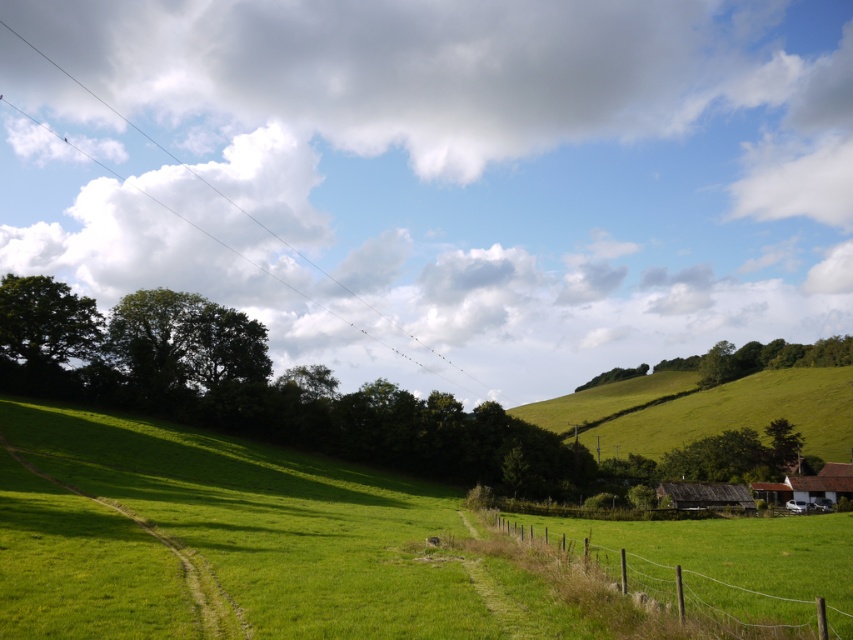
Question: Is wire mesh fence at lower right wider than green grassy hillside at center?

Choices:
 (A) no
 (B) yes

Answer: (A)

Question: Does wire mesh fence at lower right have a greater width compared to green grassy hillside at center?

Choices:
 (A) no
 (B) yes

Answer: (A)

Question: Which point appears farthest from the camera in this image?

Choices:
 (A) (544, 406)
 (B) (692, 564)

Answer: (A)

Question: Does wire mesh fence at lower right have a larger size compared to green grassy hillside at center?

Choices:
 (A) yes
 (B) no

Answer: (B)